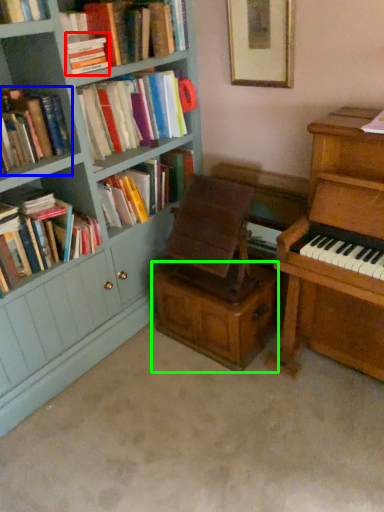
Question: Estimate the real-world distances between objects in this image. Which object is farther from book (highlighted by a red box), book (highlighted by a blue box) or drawer (highlighted by a green box)?

Choices:
 (A) book
 (B) drawer

Answer: (B)